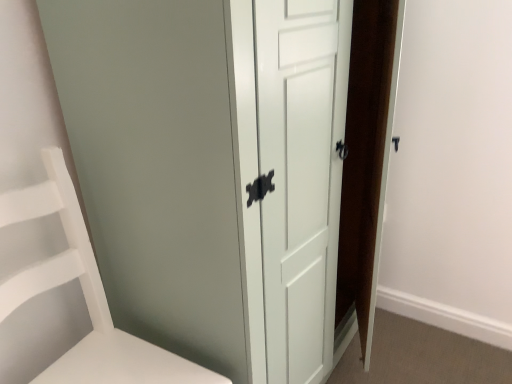
Measure the distance between point [270,205] and camera.

Point [270,205] is 94.00 centimeters away from camera.

What do you see at coordinates (210, 172) in the screenshot? I see `white glossy door at center` at bounding box center [210, 172].

Identify the location of white glossy door at center. (210, 172).

In order to face white glossy door at center, should I rotate leftwards or rightwards?

Rotate right and turn 2.187 degrees.

You are a GUI agent. You are given a task and a screenshot of the screen. Output one action in this format:
    pyautogui.click(x=<x>, y=<y>)
    Task: Click on the white matte shelf at left
    The height and width of the screenshot is (384, 512).
    Given the screenshot: What is the action you would take?
    pyautogui.click(x=83, y=294)

This screenshot has height=384, width=512. What do you see at coordinates (83, 294) in the screenshot?
I see `white matte shelf at left` at bounding box center [83, 294].

Measure the distance between point (x=124, y=332) and camera.

4.03 feet.

Where is `white glossy door at center`? white glossy door at center is located at coordinates (210, 172).

Visually, is white glossy door at center positioned to the left or to the right of white matte shelf at left?

Clearly, white glossy door at center is on the right of white matte shelf at left in the image.

Is the position of white glossy door at center less distant than that of white matte shelf at left?

No, the depth of white glossy door at center is greater than that of white matte shelf at left.

Does point (172, 206) come behind point (106, 336)?

No, it is in front of (106, 336).

From the image's perspective, between white glossy door at center and white matte shelf at left, who is located below?

white matte shelf at left, from the image's perspective.

From a real-world perspective, is white glossy door at center physically above white matte shelf at left?

Yes.

Does white glossy door at center have a lesser width compared to white matte shelf at left?

In fact, white glossy door at center might be wider than white matte shelf at left.

Considering the sizes of objects white glossy door at center and white matte shelf at left in the image provided, who is taller, white glossy door at center or white matte shelf at left?

Standing taller between the two is white glossy door at center.

Can you confirm if white glossy door at center is smaller than white matte shelf at left?

No, white glossy door at center is not smaller than white matte shelf at left.

Is white glossy door at center inside or outside of white matte shelf at left?

white glossy door at center exists outside the volume of white matte shelf at left.

Would you consider white glossy door at center to be distant from white matte shelf at left?

They are positioned close to each other.

Is white glossy door at center oriented away from white matte shelf at left?

No, white glossy door at center is not facing away from white matte shelf at left.

Where is `door above the white matte shelf at left (from a real-world perspective)`? This screenshot has height=384, width=512. door above the white matte shelf at left (from a real-world perspective) is located at coordinates (210, 172).

Does white matte shelf at left appear on the left side of white glossy door at center?

Correct, you'll find white matte shelf at left to the left of white glossy door at center.

Considering the positions of objects white matte shelf at left and white glossy door at center in the image provided, who is behind, white matte shelf at left or white glossy door at center?

white glossy door at center is behind.

Which is nearer, (x=36, y=294) or (x=120, y=24)?

Point (x=36, y=294) is farther from the camera than point (x=120, y=24).

From the image's perspective, would you say white matte shelf at left is shown under white glossy door at center?

Correct, white matte shelf at left appears lower than white glossy door at center in the image.

From a real-world perspective, which is physically above, white matte shelf at left or white glossy door at center?

In real-world perspective, white glossy door at center is above.

Considering the sizes of objects white matte shelf at left and white glossy door at center in the image provided, who is thinner, white matte shelf at left or white glossy door at center?

With smaller width is white matte shelf at left.

Is white matte shelf at left taller than white glossy door at center?

No, white matte shelf at left is not taller than white glossy door at center.

Considering the relative sizes of white matte shelf at left and white glossy door at center in the image provided, is white matte shelf at left bigger than white glossy door at center?

Actually, white matte shelf at left might be smaller than white glossy door at center.

Is white matte shelf at left spatially inside white glossy door at center, or outside of it?

white matte shelf at left is located beyond the bounds of white glossy door at center.

Does white matte shelf at left touch white glossy door at center?

No, white matte shelf at left is not beside white glossy door at center.

Is white matte shelf at left oriented away from white glossy door at center?

No, white matte shelf at left is not facing away from white glossy door at center.

How many degrees apart are the facing directions of white matte shelf at left and white glossy door at center?

The facing directions of white matte shelf at left and white glossy door at center are 2.52 degrees apart.

Locate an element on the screen. This screenshot has width=512, height=384. furniture located below the white glossy door at center (from the image's perspective) is located at coordinates (83, 294).

The image size is (512, 384). Identify the location of door that is on the right side of white matte shelf at left. (210, 172).

Where is `door above the white matte shelf at left (from a real-world perspective)`? door above the white matte shelf at left (from a real-world perspective) is located at coordinates (210, 172).